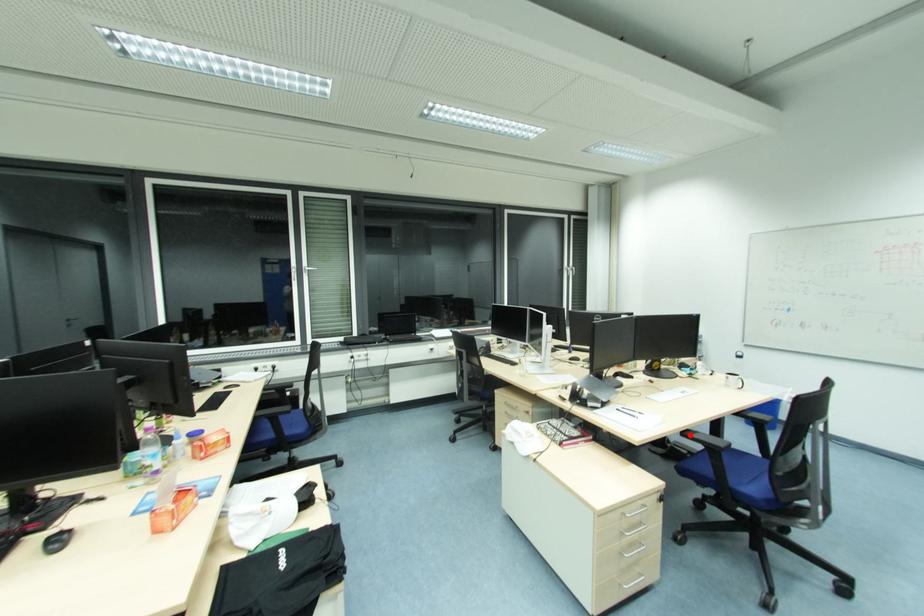
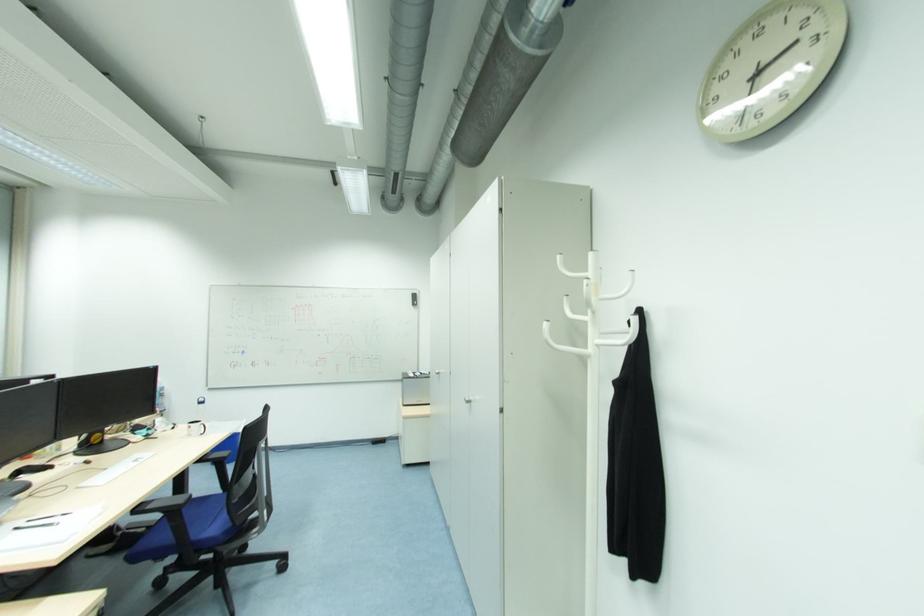
Question: I am providing you with two images of the same scene from different viewpoints. Image1 has a red point marked. In image2, the corresponding 3D location appears at what relative position? Reply with the corresponding letter.

Choices:
 (A) Closer
 (B) Farther

Answer: (A)